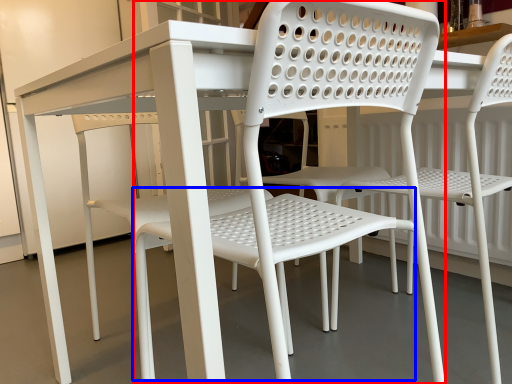
Question: Which of the following is the farthest to the observer, chair (highlighted by a red box) or bar stool (highlighted by a blue box)?

Choices:
 (A) chair
 (B) bar stool

Answer: (B)